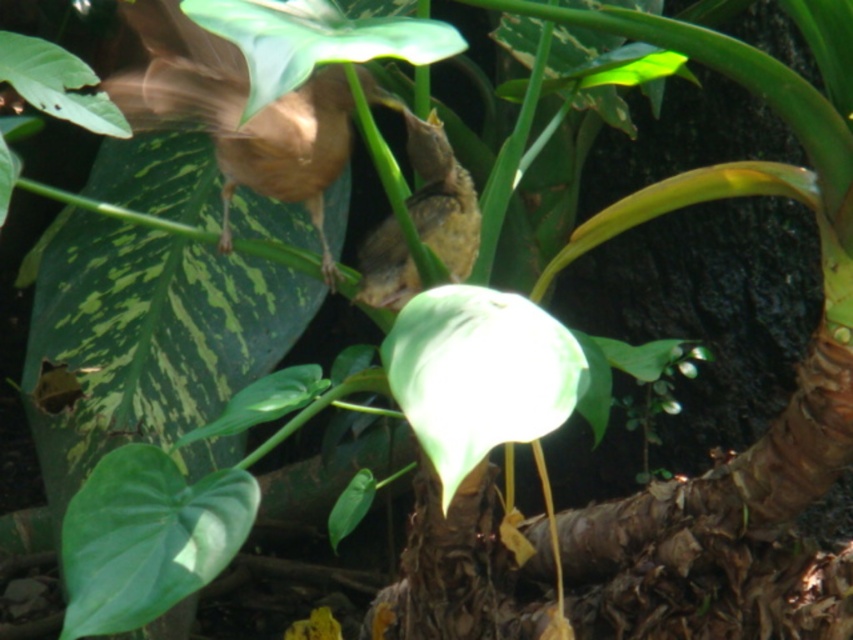
You are a birdwatcher trying to locate the bird at point [314,38] in the image. Based on the scene description, where should you look?

The point [314,38] is on the green matte leaf at upper center, so you should look at the green matte leaf at upper center to find the bird.

You are a photographer trying to capture both the green matte leaf at lower left and the brown matte bird at center in a single frame. Based on their heights, which object should you focus on first to ensure both are in the frame?

The green matte leaf at lower left has a lesser height compared to the brown matte bird at center, so you should focus on the brown matte bird at center first to ensure both are in the frame.